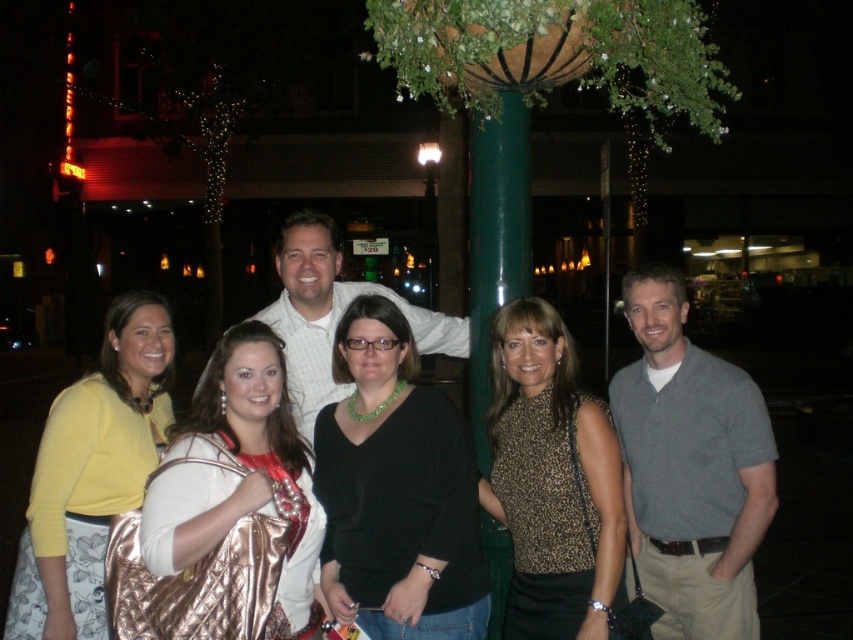
Question: Which of these objects is positioned closest to the metallic gold purse at center?

Choices:
 (A) leopard print top at center
 (B) yellow sweater at center
 (C) black matte sweater at center

Answer: (C)

Question: Which object appears farthest from the camera in this image?

Choices:
 (A) leopard print top at center
 (B) black matte sweater at center
 (C) metallic gold purse at center
 (D) yellow sweater at center

Answer: (B)

Question: Estimate the real-world distances between objects in this image. Which object is closer to the black matte sweater at center?

Choices:
 (A) yellow sweater at center
 (B) metallic gold purse at center
 (C) metallic gold lamp post at center

Answer: (B)

Question: Is black matte sweater at center bigger than metallic gold lamp post at center?

Choices:
 (A) yes
 (B) no

Answer: (B)

Question: Is yellow sweater at center to the right of metallic gold purse at center from the viewer's perspective?

Choices:
 (A) no
 (B) yes

Answer: (A)

Question: Does yellow sweater at center appear under metallic gold lamp post at center?

Choices:
 (A) yes
 (B) no

Answer: (A)